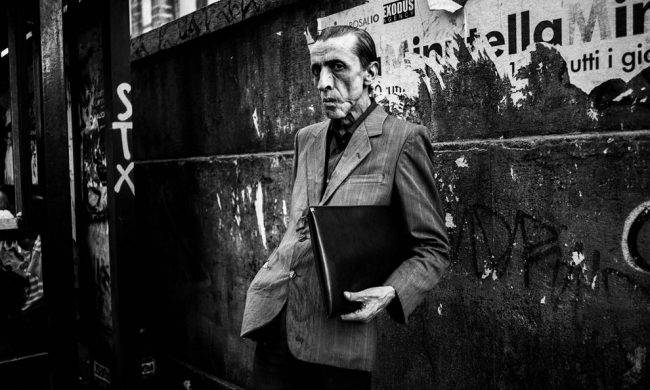
At what (x,y) coordinates should I click in order to perform the action: click on wall. Please return your answer as a coordinate pair (x, y). This screenshot has width=650, height=390. Looking at the image, I should click on (270, 116).